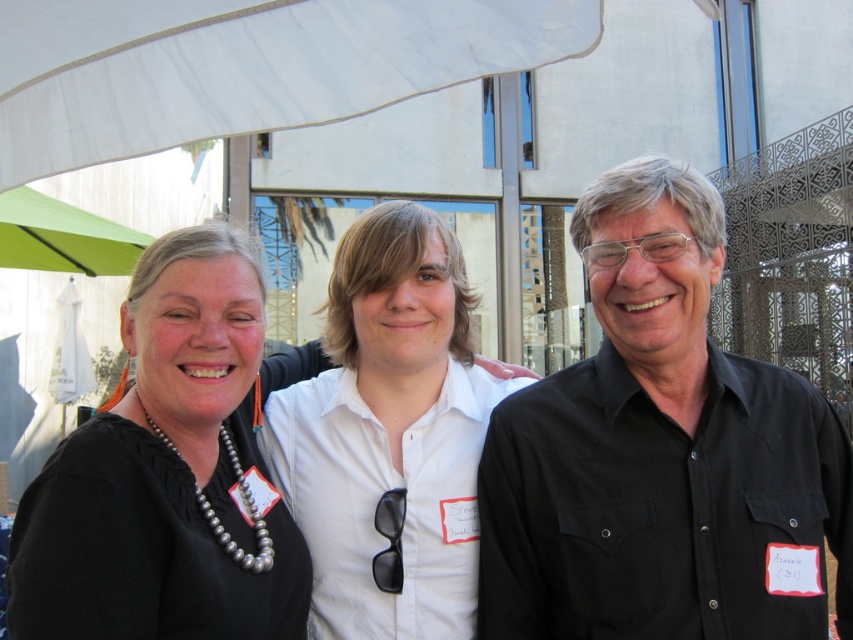
Question: Which of the following is the farthest from the observer?

Choices:
 (A) green fabric umbrella at upper left
 (B) black matte shirt at center
 (C) white fabric canopy at upper center

Answer: (A)

Question: Can you confirm if black matte shirt at center is smaller than black matte necklace at upper left?

Choices:
 (A) no
 (B) yes

Answer: (B)

Question: In this image, where is black matte necklace at upper left located relative to white fabric canopy at upper center?

Choices:
 (A) left
 (B) right

Answer: (A)

Question: Which of the following is the closest to the observer?

Choices:
 (A) green fabric umbrella at upper left
 (B) black matte necklace at upper left
 (C) black matte shirt at center
 (D) white fabric canopy at upper center

Answer: (B)

Question: Which object appears closest to the camera in this image?

Choices:
 (A) white fabric canopy at upper center
 (B) black matte necklace at upper left
 (C) green fabric umbrella at upper left

Answer: (B)

Question: Does black matte shirt at center have a lesser width compared to green fabric umbrella at upper left?

Choices:
 (A) no
 (B) yes

Answer: (B)